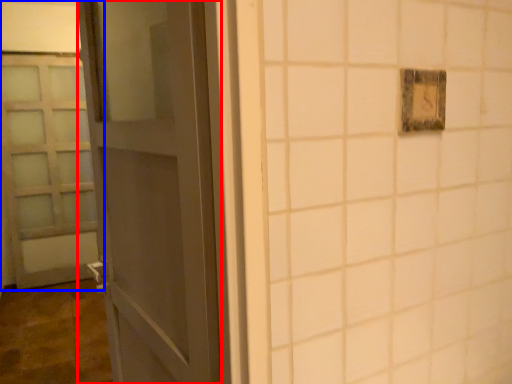
Question: Among these objects, which one is farthest to the camera, door (highlighted by a red box) or door (highlighted by a blue box)?

Choices:
 (A) door
 (B) door

Answer: (B)